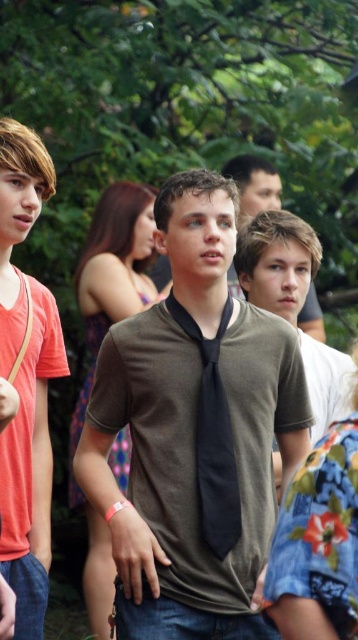
Is matte brown shirt at center wider than matte green shirt at center?

Yes.

Is point (243, 637) positioned before point (259, 195)?

Yes, point (243, 637) is in front of point (259, 195).

Locate an element on the screen. This screenshot has width=358, height=640. matte brown shirt at center is located at coordinates point(194,433).

Measure the distance from matte brown shirt at center to black silk tie at center.

matte brown shirt at center is 19.19 centimeters away from black silk tie at center.

Is matte brown shirt at center wider than black silk tie at center?

Yes.

Which is behind, point (268, 330) or point (207, 536)?

Point (268, 330)

Image resolution: width=358 pixels, height=640 pixels. I want to click on matte brown shirt at center, so click(194, 433).

Which of these two, black silk tie at center or matte green shirt at center, stands shorter?

matte green shirt at center

Which is behind, point (197, 326) or point (248, 216)?

Point (248, 216)

What are the coordinates of `black silk tie at center` in the screenshot? It's located at (213, 440).